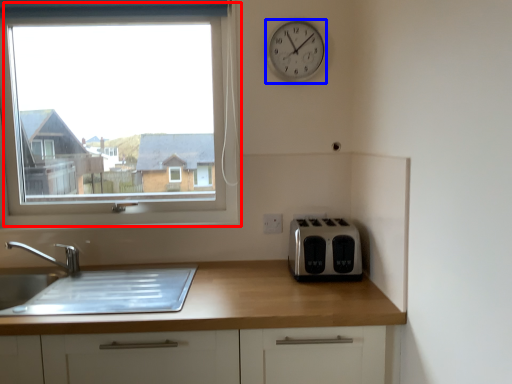
Question: Which point is closer to the camera, window (highlighted by a red box) or clock (highlighted by a blue box)?

Choices:
 (A) window
 (B) clock

Answer: (B)